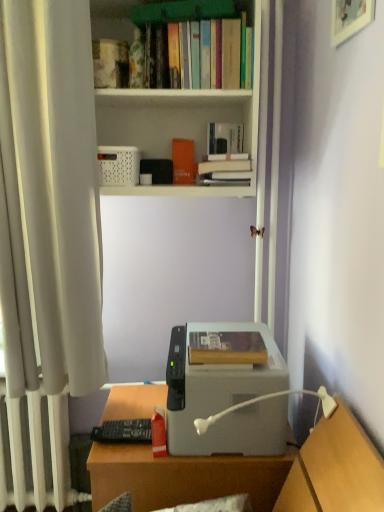
Question: Is wooden picture frame at upper right to the left or to the right of white plastic bookcase at upper center in the image?

Choices:
 (A) right
 (B) left

Answer: (A)

Question: Is wooden picture frame at upper right bigger or smaller than white plastic bookcase at upper center?

Choices:
 (A) small
 (B) big

Answer: (A)

Question: Which object is the closest to the white plastic radiator at left?

Choices:
 (A) hardcover book at center, arranged as the first book when viewed from the front
 (B) hardcover book at upper center, which is counted as the second book, starting from the top
 (C) gray matte printer at center
 (D) wooden picture frame at upper right
 (E) orange matte paperback book at upper center

Answer: (C)

Question: Based on their relative distances, which object is farther from the gray matte printer at center?

Choices:
 (A) hardcover book at upper center, which is counted as the second book, starting from the top
 (B) white plastic radiator at left
 (C) wooden picture frame at upper right
 (D) hardcover books at upper center, which is the 3th book in bottom-to-top order
 (E) white plastic lamp at lower center

Answer: (D)